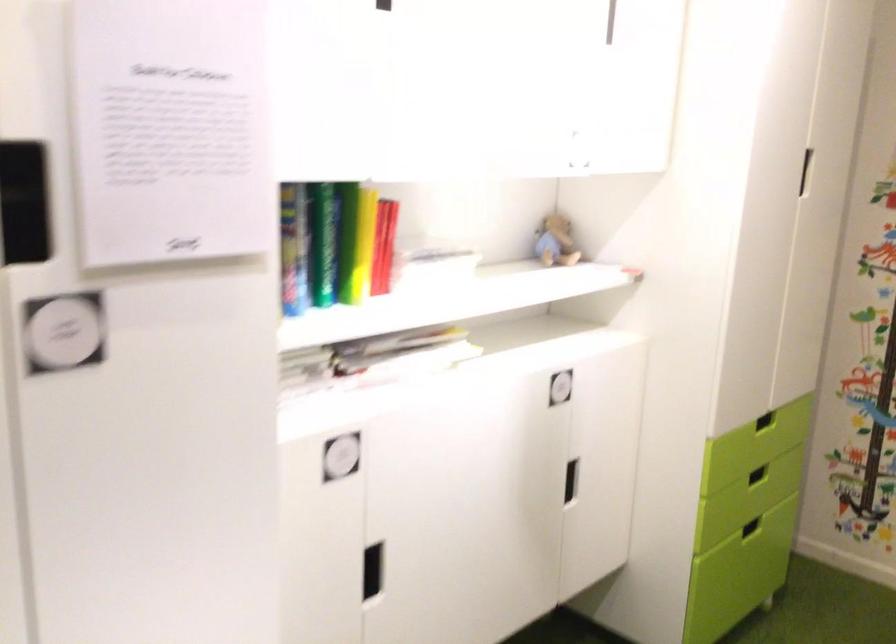
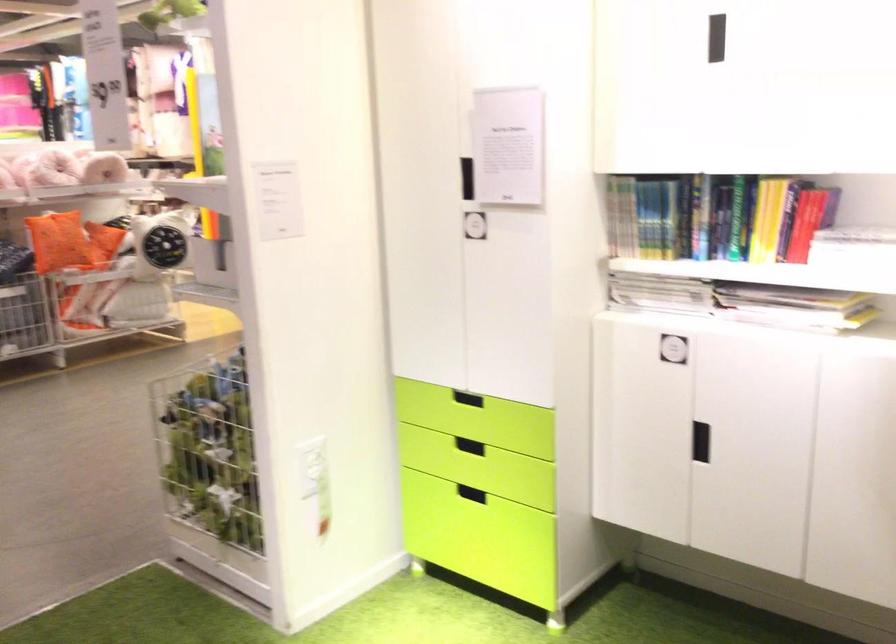
Find the pixel in the second image that matches (419,351) in the first image.

(794, 307)